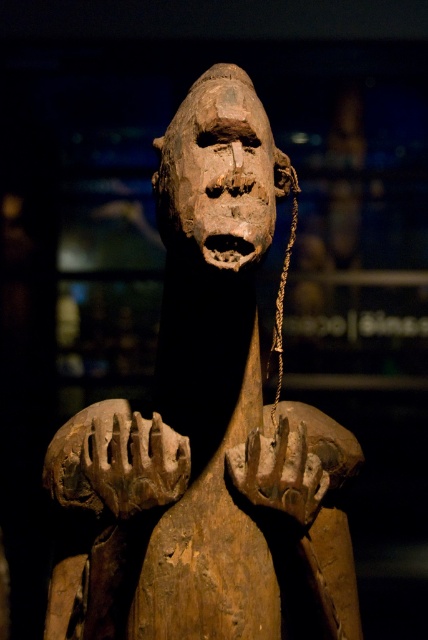
You are an art conservator examining the wooden statue at center and the wooden mask at center. Which object is positioned lower in the image?

The wooden statue at center is located below the wooden mask at center, so the wooden statue at center is positioned lower in the image.

Based on the photo, you are an art conservator examining the wooden statue at center. Based on its position at coordinates, is it placed closer to the left or right side of the display area?

The wooden statue at center is located at point coordinates, so it is positioned closer to the right side of the display area since the x coordinate 0.670 is closer to 1.0 than to 0.0.